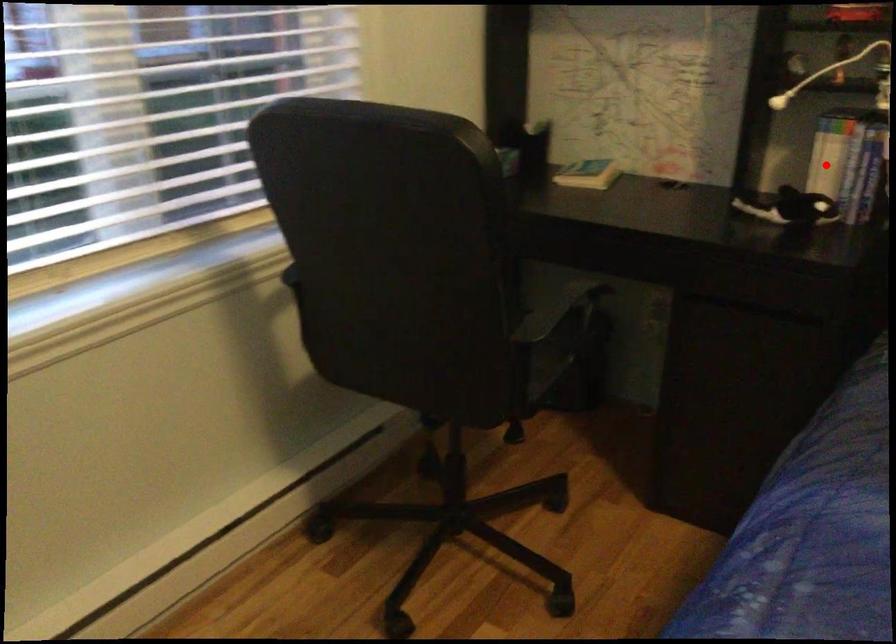
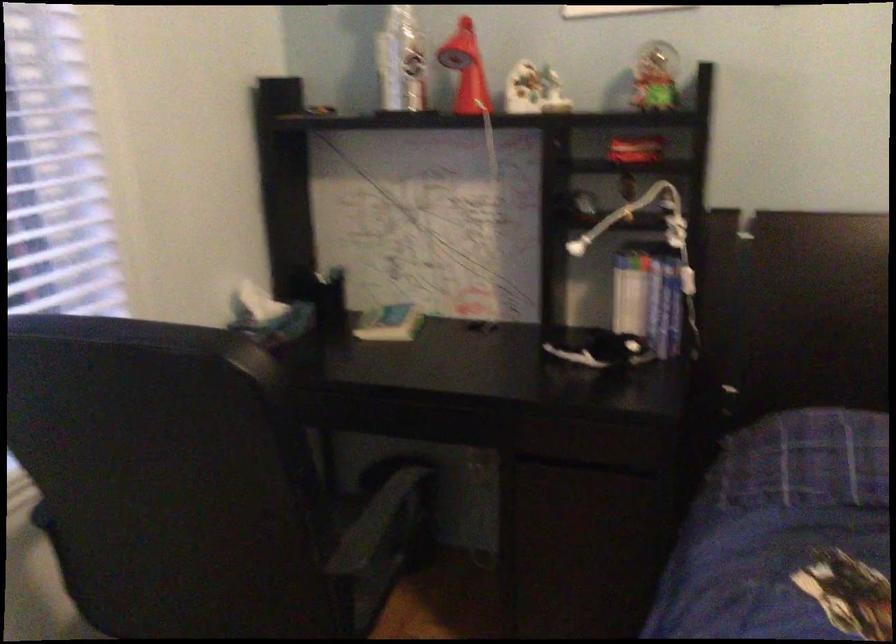
Locate, in the second image, the point that corresponds to the highlighted location in the first image.

(629, 301)